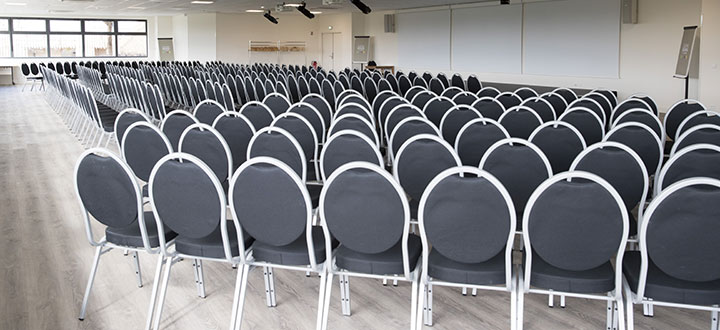
Identify the location of window panes. This screenshot has height=330, width=720. (125, 43), (96, 44), (72, 47), (27, 44), (1, 47), (4, 26), (24, 22), (55, 24), (99, 27), (122, 27).